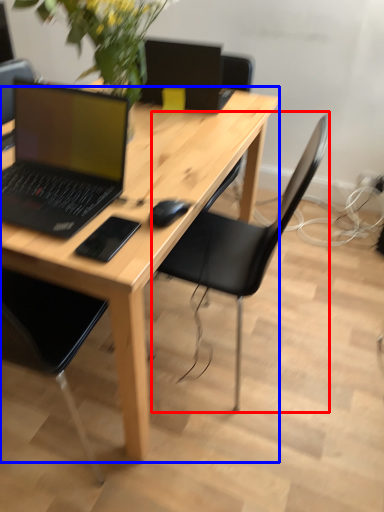
Question: Which of the following is the farthest to the observer, chair (highlighted by a red box) or desk (highlighted by a blue box)?

Choices:
 (A) chair
 (B) desk

Answer: (A)